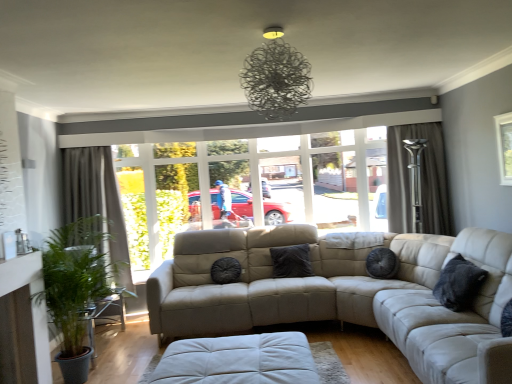
Where is `free space above metallic wire chandelier at upper center (from a real-world perspective)`? This screenshot has height=384, width=512. free space above metallic wire chandelier at upper center (from a real-world perspective) is located at coordinates (285, 22).